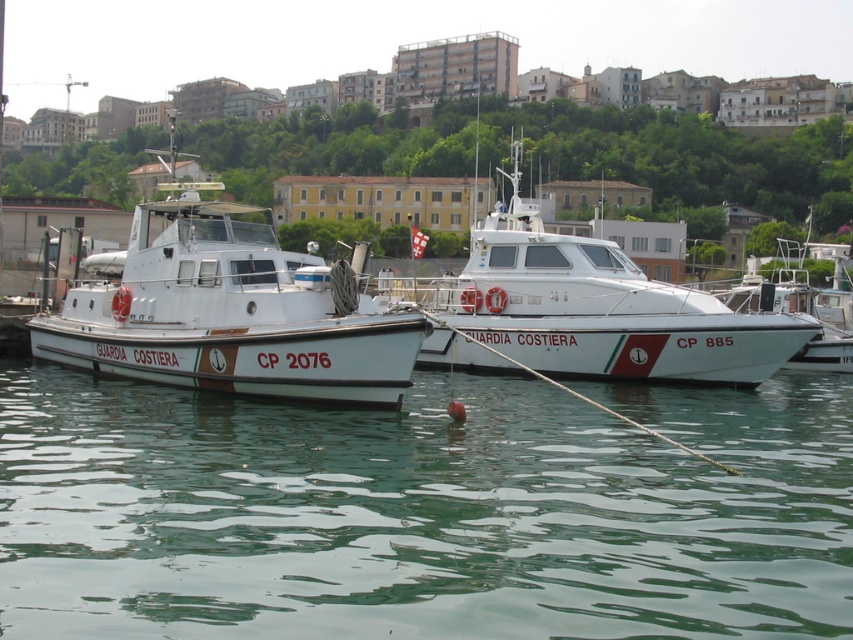
Who is higher up, green smooth water at center or white glossy boat at left?

white glossy boat at left

Is point (480, 384) positioned before point (221, 372)?

No, (480, 384) is further to viewer.

Between point (39, 480) and point (137, 288), which one is positioned behind?

The point (137, 288) is behind.

The image size is (853, 640). I want to click on green smooth water at center, so click(x=422, y=513).

Is white glossy boat at left smaller than white glossy boat at center?

Yes.

Image resolution: width=853 pixels, height=640 pixels. In order to click on white glossy boat at left in this screenshot , I will do `click(229, 310)`.

Locate an element on the screen. This screenshot has width=853, height=640. white glossy boat at left is located at coordinates (229, 310).

Does green smooth water at center have a smaller size compared to white glossy boat at center?

Yes.

Between point (350, 602) and point (630, 301), which one is positioned in front?

Point (350, 602) is more forward.

Locate an element on the screen. The width and height of the screenshot is (853, 640). green smooth water at center is located at coordinates (422, 513).